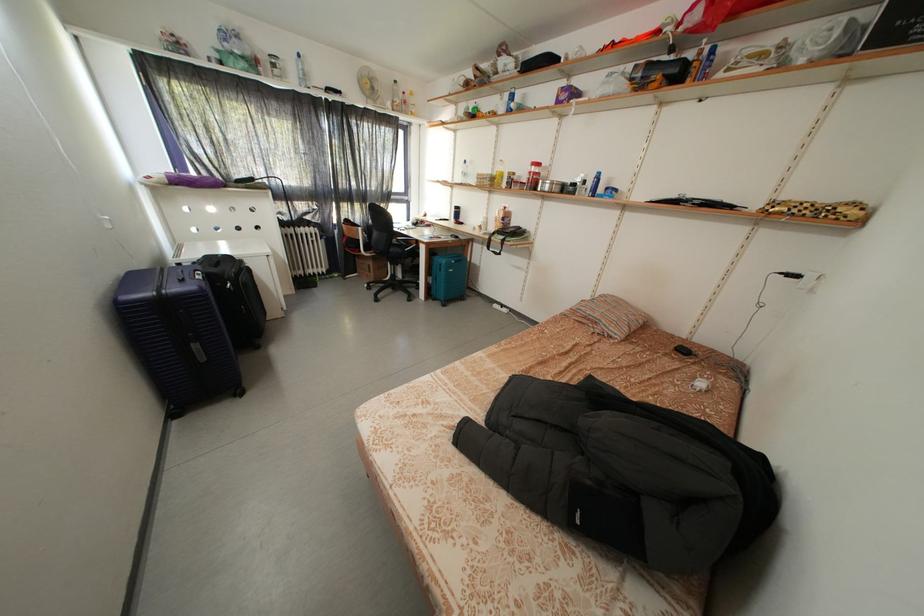
Describe the element at coordinates (532, 176) in the screenshot. The height and width of the screenshot is (616, 924). I see `the red jar` at that location.